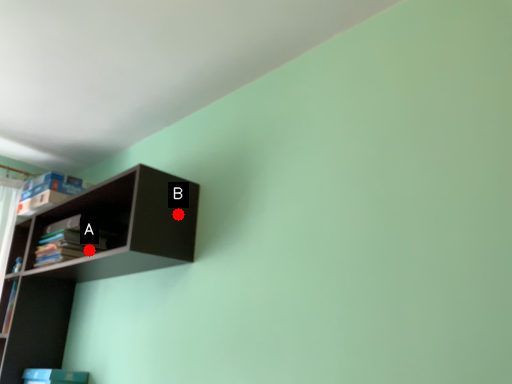
Question: Two points are circled on the image, labeled by A and B beside each circle. Which of the following is the closest to the observer?

Choices:
 (A) A is closer
 (B) B is closer

Answer: (B)